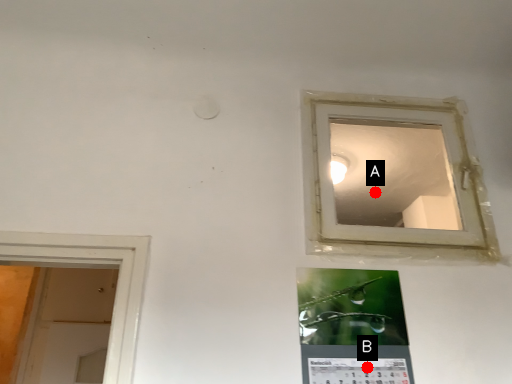
Question: Two points are circled on the image, labeled by A and B beside each circle. Which point is farther to the camera?

Choices:
 (A) A is further
 (B) B is further

Answer: (A)